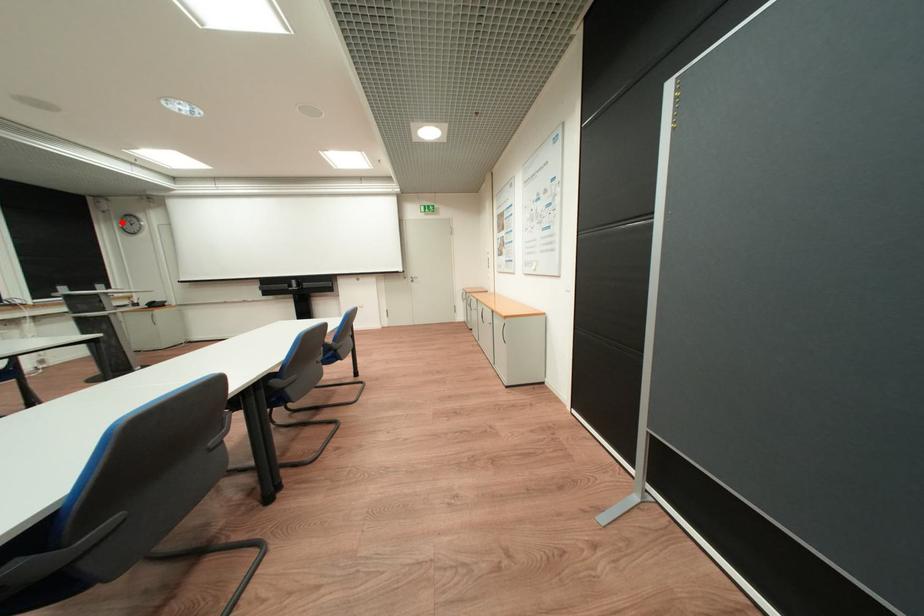
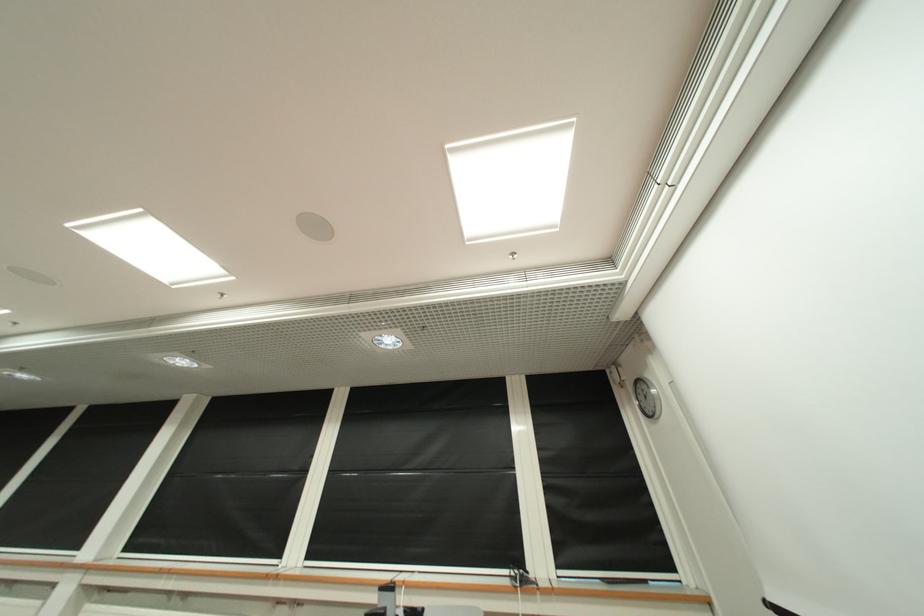
Find the pixel in the second image that matches the highlighted location in the first image.

(642, 402)